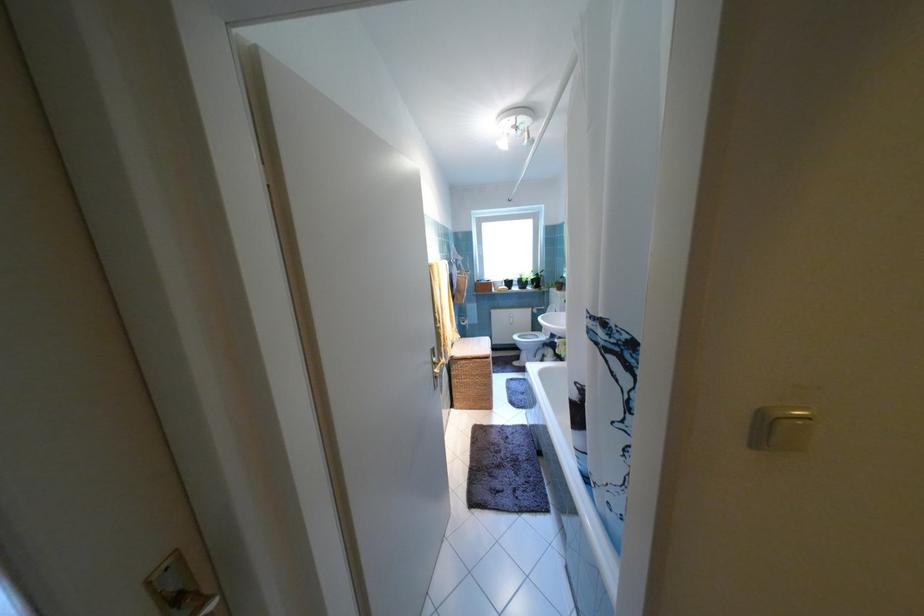
Find where to press the beige light switch. Please return your answer as a coordinate pair (x, y).

(782, 429)